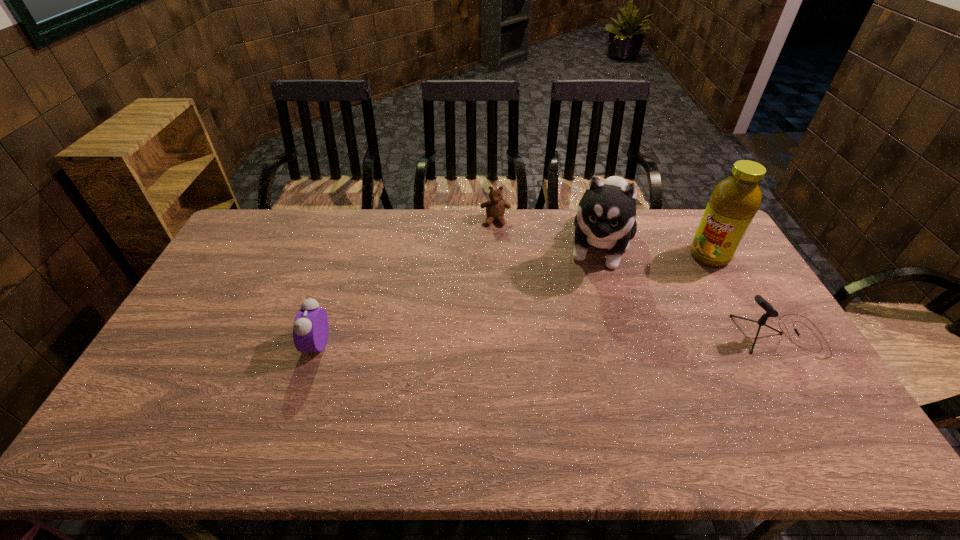
Where is `free point between the fruit juice and the leftmost object`? Image resolution: width=960 pixels, height=540 pixels. free point between the fruit juice and the leftmost object is located at coordinates (514, 299).

Identify the location of vacant region between the fruit juice and the puppy. (654, 251).

At what (x,y) coordinates should I click in order to perform the action: click on vacant area between the microphone and the second object from left to right. Please return your answer as a coordinate pair (x, y). The width and height of the screenshot is (960, 540). Looking at the image, I should click on (637, 278).

The image size is (960, 540). What are the coordinates of `unoccupied area between the teddy bear and the puppy` in the screenshot? It's located at (547, 233).

You are a GUI agent. You are given a task and a screenshot of the screen. Output one action in this format:
    pyautogui.click(x=<x>, y=<y>)
    Task: Click on the unoccupied position between the leftmost object and the microphone
    The image size is (960, 540).
    Given the screenshot: What is the action you would take?
    [548, 340]

Locate an element on the screen. unoccupied area between the alarm clock and the microphone is located at coordinates (548, 340).

You are a GUI agent. You are given a task and a screenshot of the screen. Output one action in this format:
    pyautogui.click(x=<x>, y=<y>)
    Task: Click on the unoccupied position between the third object from right to left and the microphone
    The image size is (960, 540).
    Given the screenshot: What is the action you would take?
    pyautogui.click(x=689, y=291)

Identify the location of object that is the closest to the fruit juice. (605, 218).

Where is `object that is the second closest one to the microphone`? Image resolution: width=960 pixels, height=540 pixels. object that is the second closest one to the microphone is located at coordinates (605, 218).

This screenshot has height=540, width=960. What are the coordinates of `vacant space that satisfies the following two spatial constraints: 1. on the front side of the teddy bear; 2. on the stand of the microphone` in the screenshot? It's located at (500, 335).